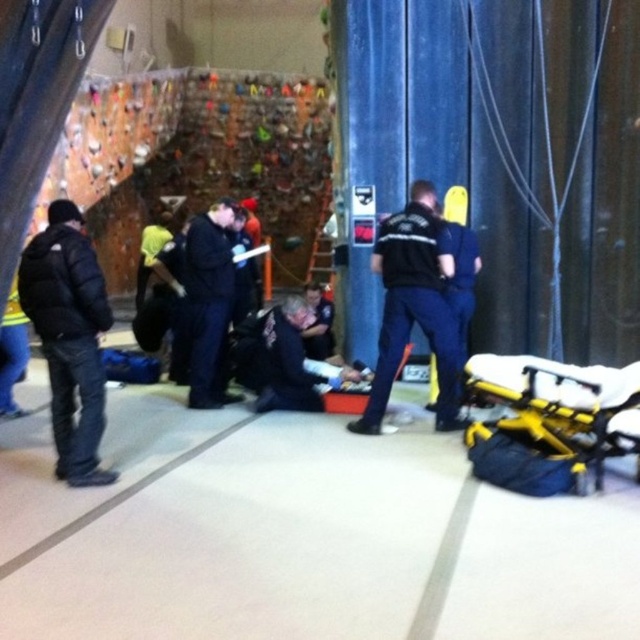
You are an emergency responder in the climbing gym and need to reach both the point at (566,452) and the point at (56,349). Which point should you reach first if you want to attend to the closer one first?

You should reach point (56,349) first because it is closer to you than point (566,452), which is further away.

Looking at this image, you are an observer in the climbing gym. You see a black fabric jacket at center and a blue uniform at center. Which one is positioned more to the left?

The black fabric jacket at center is positioned more to the left than the blue uniform at center.

You are an emergency responder in the climbing gym. You need to quickly move from your current position at point (477,269) to the first aid kit at point (58,438). Is the first aid kit directly in front of you?

Yes, the first aid kit at point (58,438) is directly in front of you because it is located in front of your current position at point (477,269).